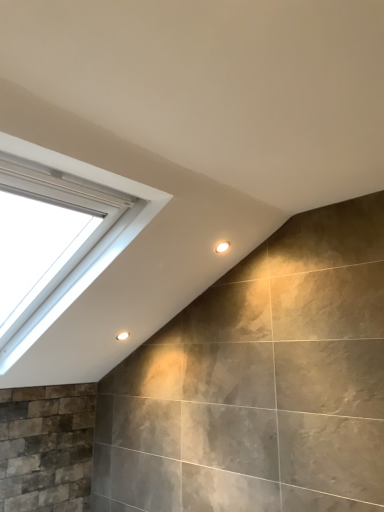
You are a GUI agent. You are given a task and a screenshot of the screen. Output one action in this format:
    pyautogui.click(x=<x>, y=<y>)
    Task: Click on the matte white light fixture at upper center
    This screenshot has height=512, width=384.
    Given the screenshot: What is the action you would take?
    pyautogui.click(x=122, y=336)

The width and height of the screenshot is (384, 512). What do you see at coordinates (122, 336) in the screenshot?
I see `matte white light fixture at upper center` at bounding box center [122, 336].

You are a GUI agent. You are given a task and a screenshot of the screen. Output one action in this format:
    pyautogui.click(x=<x>, y=<y>)
    Task: Click on the matte white light fixture at upper center
    This screenshot has height=512, width=384.
    Given the screenshot: What is the action you would take?
    pyautogui.click(x=122, y=336)